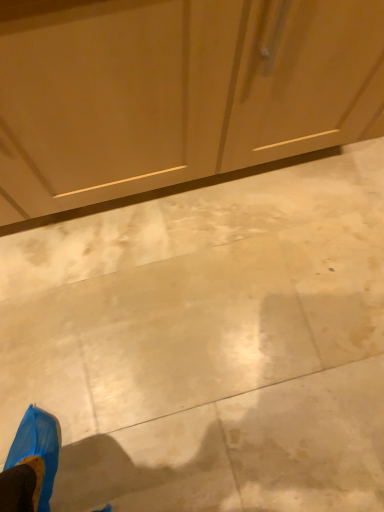
In order to click on beige polished concrete at center in this screenshot , I will do `click(208, 344)`.

In the scene shown: Measure the distance between beige polished concrete at center and camera.

A: The depth of beige polished concrete at center is 3.45 feet.

Describe the element at coordinates (208, 344) in the screenshot. I see `beige polished concrete at center` at that location.

Describe the element at coordinates (175, 91) in the screenshot. I see `matte wood dresser at upper center` at that location.

Identify the location of matte wood dresser at upper center. The image size is (384, 512). (175, 91).

The height and width of the screenshot is (512, 384). I want to click on beige polished concrete at center, so pyautogui.click(x=208, y=344).

Can you confirm if beige polished concrete at center is positioned to the left of matte wood dresser at upper center?

In fact, beige polished concrete at center is to the right of matte wood dresser at upper center.

Does beige polished concrete at center come in front of matte wood dresser at upper center?

That is False.

Is point (314, 183) in front of point (160, 40)?

That is False.

From the image's perspective, is beige polished concrete at center located above or below matte wood dresser at upper center?

beige polished concrete at center is below matte wood dresser at upper center.

From a real-world perspective, is beige polished concrete at center positioned under matte wood dresser at upper center based on gravity?

Yes, from a real-world perspective, beige polished concrete at center is below matte wood dresser at upper center.

Which of these two, beige polished concrete at center or matte wood dresser at upper center, is thinner?

matte wood dresser at upper center is thinner.

From their relative heights in the image, would you say beige polished concrete at center is taller or shorter than matte wood dresser at upper center?

Considering their sizes, beige polished concrete at center has less height than matte wood dresser at upper center.

Does beige polished concrete at center have a smaller size compared to matte wood dresser at upper center?

Correct, beige polished concrete at center occupies less space than matte wood dresser at upper center.

In the scene shown: Is matte wood dresser at upper center a part of beige polished concrete at center?

No, beige polished concrete at center does not contain matte wood dresser at upper center.

Is beige polished concrete at center directly adjacent to matte wood dresser at upper center?

beige polished concrete at center and matte wood dresser at upper center are clearly separated.

Is beige polished concrete at center turned away from matte wood dresser at upper center?

No, matte wood dresser at upper center is not at the back of beige polished concrete at center.

Can you tell me how much beige polished concrete at center and matte wood dresser at upper center differ in facing direction?

They differ by 90.5 degrees in their facing directions.

This screenshot has height=512, width=384. There is a beige polished concrete at center. In order to click on dresser above it (from a real-world perspective) in this screenshot , I will do `click(175, 91)`.

In the image, is matte wood dresser at upper center on the left side or the right side of beige polished concrete at center?

matte wood dresser at upper center is to the left of beige polished concrete at center.

Which object is closer to the camera, matte wood dresser at upper center or beige polished concrete at center?

matte wood dresser at upper center is closer to the camera.

Which point is more forward, [339,57] or [62,265]?

A: Positioned in front is point [339,57].

From the image's perspective, does matte wood dresser at upper center appear higher than beige polished concrete at center?

Indeed, from the image's perspective, matte wood dresser at upper center is shown above beige polished concrete at center.

From a real-world perspective, is matte wood dresser at upper center physically located above or below beige polished concrete at center?

Clearly, from a real-world perspective, matte wood dresser at upper center is above beige polished concrete at center.

Which of these two, matte wood dresser at upper center or beige polished concrete at center, is wider?

With larger width is beige polished concrete at center.

Does matte wood dresser at upper center have a lesser height compared to beige polished concrete at center?

In fact, matte wood dresser at upper center may be taller than beige polished concrete at center.

Who is smaller, matte wood dresser at upper center or beige polished concrete at center?

Smaller between the two is beige polished concrete at center.

Is matte wood dresser at upper center completely or partially outside of beige polished concrete at center?

Absolutely, matte wood dresser at upper center is external to beige polished concrete at center.

Is matte wood dresser at upper center positioned far away from beige polished concrete at center?

No, there isn't a large distance between matte wood dresser at upper center and beige polished concrete at center.

Is matte wood dresser at upper center facing away from beige polished concrete at center?

No, beige polished concrete at center is not at the back of matte wood dresser at upper center.

Can you tell me how much matte wood dresser at upper center and beige polished concrete at center differ in facing direction?

The angular difference between matte wood dresser at upper center and beige polished concrete at center is 90.5 degrees.

How far apart are matte wood dresser at upper center and beige polished concrete at center?

44.01 centimeters.

This screenshot has width=384, height=512. Identify the location of concrete to the right of matte wood dresser at upper center. (208, 344).

Locate an element on the screen. Image resolution: width=384 pixels, height=512 pixels. concrete that is below the matte wood dresser at upper center (from the image's perspective) is located at coordinates (208, 344).

Image resolution: width=384 pixels, height=512 pixels. I want to click on dresser above the beige polished concrete at center (from a real-world perspective), so click(175, 91).